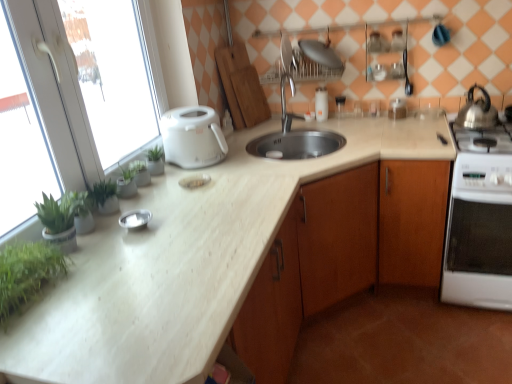
Question: Can you confirm if silver metallic bowl at center, which ranks as the fourth appliance in back-to-front order, is smaller than white glossy oven at right?

Choices:
 (A) yes
 (B) no

Answer: (A)

Question: Are silver metallic bowl at center, which ranks as the fourth appliance in back-to-front order, and white glossy oven at right far apart?

Choices:
 (A) no
 (B) yes

Answer: (B)

Question: Does silver metallic bowl at center, which ranks as the fourth appliance in back-to-front order, appear on the right side of white glossy oven at right?

Choices:
 (A) no
 (B) yes

Answer: (A)

Question: From the image's perspective, is silver metallic bowl at center, which ranks as the fourth appliance in back-to-front order, under white glossy oven at right?

Choices:
 (A) no
 (B) yes

Answer: (A)

Question: Is silver metallic bowl at center, the 1th appliance ordered from the bottom, thinner than white glossy oven at right?

Choices:
 (A) yes
 (B) no

Answer: (A)

Question: From the image's perspective, is silver metallic bowl at center, which is counted as the fourth appliance, starting from the right, located above white glossy oven at right?

Choices:
 (A) no
 (B) yes

Answer: (B)

Question: From a real-world perspective, is metallic silver plate at upper center, marked as the 3th appliance in a right-to-left arrangement, located beneath green leafy plant at left?

Choices:
 (A) yes
 (B) no

Answer: (A)

Question: Does metallic silver plate at upper center, acting as the 3th appliance starting from the back, contain green leafy plant at left?

Choices:
 (A) no
 (B) yes

Answer: (A)

Question: Is metallic silver plate at upper center, which is the first appliance from top to bottom, taller than green leafy plant at left?

Choices:
 (A) no
 (B) yes

Answer: (A)

Question: Is metallic silver plate at upper center, marked as the 3th appliance in a right-to-left arrangement, to the right of green leafy plant at left from the viewer's perspective?

Choices:
 (A) no
 (B) yes

Answer: (B)

Question: Is the position of metallic silver plate at upper center, marked as the 3th appliance in a right-to-left arrangement, less distant than that of green leafy plant at left?

Choices:
 (A) no
 (B) yes

Answer: (A)

Question: Considering the relative sizes of metallic silver plate at upper center, which ranks as the second appliance in left-to-right order, and green leafy plant at left in the image provided, is metallic silver plate at upper center, which ranks as the second appliance in left-to-right order, smaller than green leafy plant at left?

Choices:
 (A) no
 (B) yes

Answer: (B)

Question: Is green leafy plant at left surrounded by silver metallic faucet at center?

Choices:
 (A) yes
 (B) no

Answer: (B)